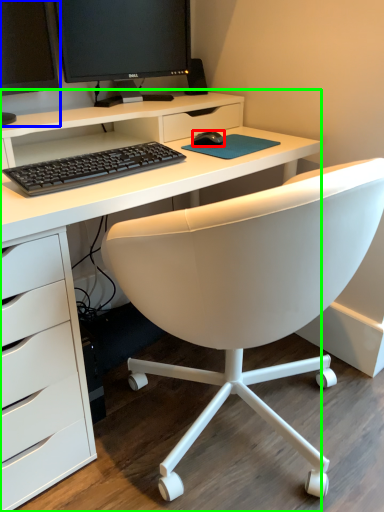
Question: Based on their relative distances, which object is farther from mouse (highlighted by a red box)? Choose from computer monitor (highlighted by a blue box) and desk (highlighted by a green box).

Choices:
 (A) computer monitor
 (B) desk

Answer: (A)